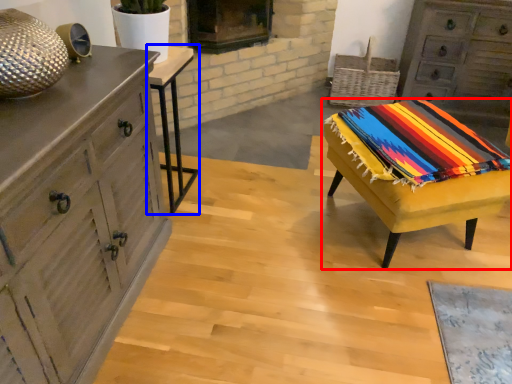
Question: Which point is closer to the camera, table (highlighted by a red box) or table (highlighted by a blue box)?

Choices:
 (A) table
 (B) table

Answer: (A)